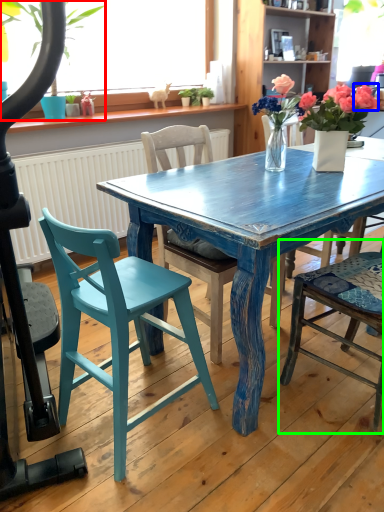
Question: Which object is the farthest from houseplant (highlighted by a red box)? Choose among these: flower (highlighted by a blue box) or chair (highlighted by a green box).

Choices:
 (A) flower
 (B) chair

Answer: (B)